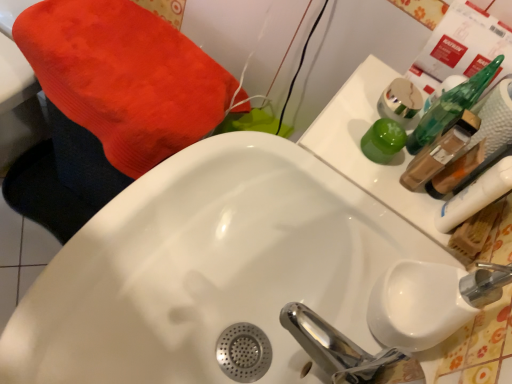
Question: Is point (398, 77) positioned closer to the camera than point (458, 147)?

Choices:
 (A) farther
 (B) closer

Answer: (A)

Question: In terms of size, does metallic gold mouthwash at upper right, which is counted as the 4th mouthwash, starting from the bottom, appear bigger or smaller than translucent plastic mouthwash at upper right, which is the 3th mouthwash in top-to-bottom order?

Choices:
 (A) big
 (B) small

Answer: (B)

Question: Estimate the real-world distances between objects in this image. Which object is closer to the translucent plastic mouthwash at right, which appears as the 1th mouthwash when ordered from the bottom?

Choices:
 (A) translucent plastic mouthwash at upper right, the 2th mouthwash ordered from the bottom
 (B) metallic gold mouthwash at upper right, which is counted as the 4th mouthwash, starting from the bottom
 (C) green glossy cup at upper right, which is counted as the third mouthwash, starting from the bottom
 (D) white glossy sink at center

Answer: (A)

Question: Based on their relative distances, which object is nearer to the translucent plastic mouthwash at upper right, which is the 3th mouthwash in top-to-bottom order?

Choices:
 (A) metallic gold mouthwash at upper right, which is counted as the 4th mouthwash, starting from the bottom
 (B) translucent plastic mouthwash at right, which appears as the 1th mouthwash when ordered from the bottom
 (C) green glossy cup at upper right, which is counted as the third mouthwash, starting from the bottom
 (D) white glossy sink at center

Answer: (B)